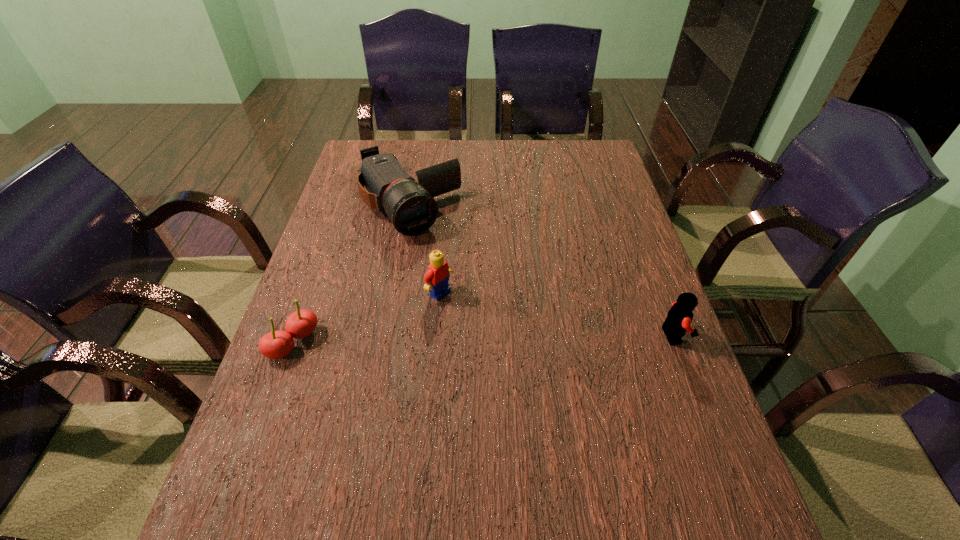
Find the location of a particular element. vacant region located on the face of the farther Lego is located at coordinates (505, 340).

Locate an element on the screen. This screenshot has width=960, height=540. free space located on the face of the farther Lego is located at coordinates (537, 362).

I want to click on blank space located on the face of the farther Lego, so click(x=470, y=315).

Where is `object at the far edge`? This screenshot has width=960, height=540. object at the far edge is located at coordinates (410, 206).

The width and height of the screenshot is (960, 540). Identify the location of cherry present at the left edge. (277, 344).

Find the location of `camcorder at the left edge`. camcorder at the left edge is located at coordinates (410, 206).

Find the location of a particular element. The width and height of the screenshot is (960, 540). object present at the right edge is located at coordinates (678, 321).

At what (x,y) coordinates should I click in order to perform the action: click on object that is at the far left corner. Please return your answer as a coordinate pair (x, y). Image resolution: width=960 pixels, height=540 pixels. Looking at the image, I should click on (410, 206).

Locate an element on the screen. This screenshot has width=960, height=540. free region at the far edge of the desktop is located at coordinates (427, 150).

This screenshot has width=960, height=540. I want to click on vacant region at the near edge of the desktop, so click(392, 478).